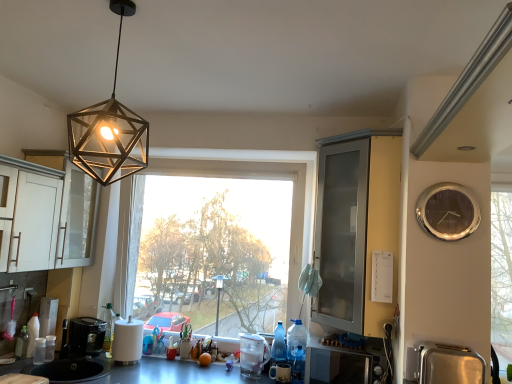
Locate an element on the screen. The width and height of the screenshot is (512, 384). free space above metallic hexagonal light fixture at upper center (from a real-world perspective) is located at coordinates (126, 14).